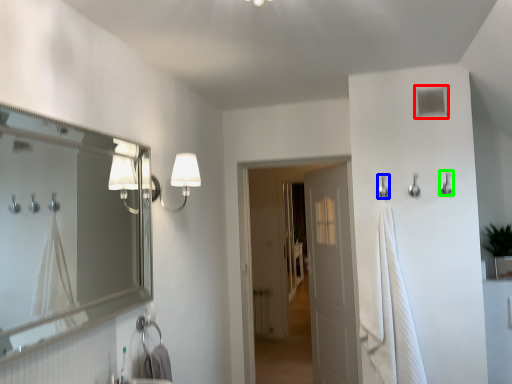
Question: Estimate the real-world distances between objects in this image. Which object is farther from window (highlighted by a red box), shower (highlighted by a blue box) or shower (highlighted by a green box)?

Choices:
 (A) shower
 (B) shower

Answer: (A)